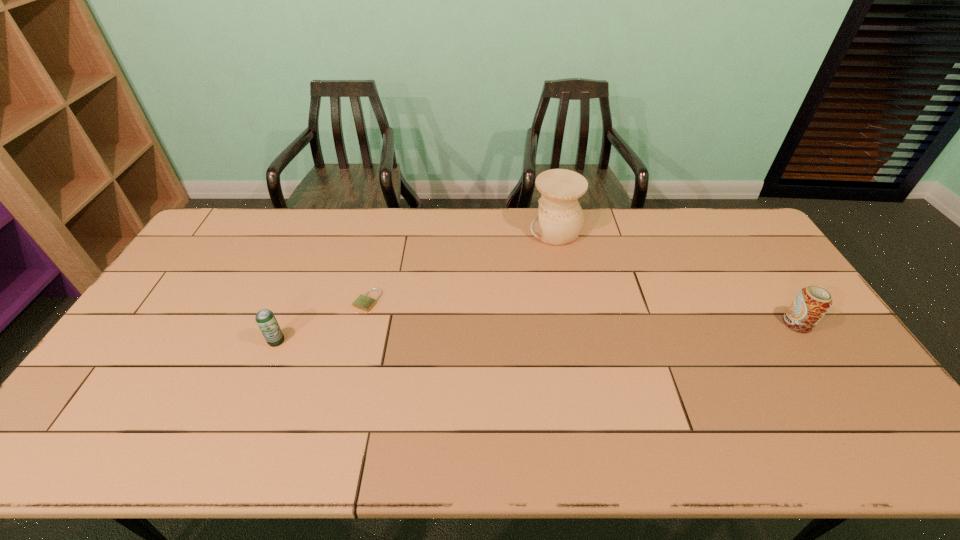
The width and height of the screenshot is (960, 540). Identify the location of the tallest object. (560, 219).

Locate an element on the screen. The width and height of the screenshot is (960, 540). the third object from left to right is located at coordinates (560, 219).

Identify the location of the right beer can. (811, 303).

Locate an element on the screen. This screenshot has height=540, width=960. the third farthest object is located at coordinates (811, 303).

Locate an element on the screen. The width and height of the screenshot is (960, 540). the leftmost object is located at coordinates point(265,318).

Find the location of a particular element. This screenshot has height=540, width=960. the nearest object is located at coordinates (265, 318).

I want to click on the second farthest object, so click(363, 302).

Where is `padlock`? The width and height of the screenshot is (960, 540). padlock is located at coordinates (363, 302).

This screenshot has width=960, height=540. What are the coordinates of `free space located 0.070m at the open side of the pottery` in the screenshot? It's located at (511, 231).

The image size is (960, 540). I want to click on vacant space located at the open side of the pottery, so click(x=430, y=231).